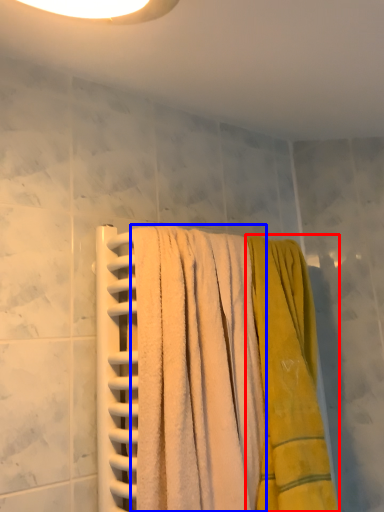
Question: Which point is further to the camera, towel (highlighted by a red box) or towel (highlighted by a blue box)?

Choices:
 (A) towel
 (B) towel

Answer: (A)